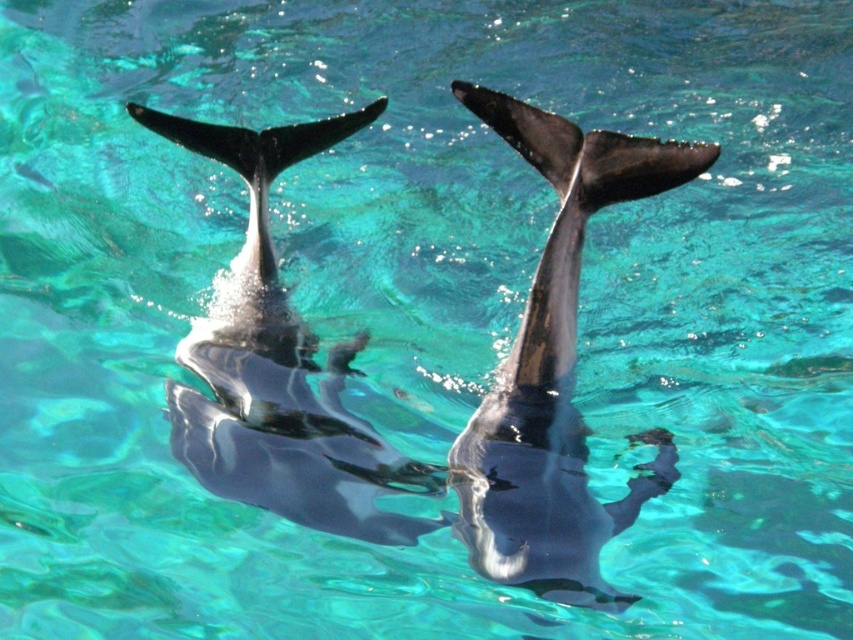
Who is shorter, glossy black dolphin at center or shiny black dolphin at center?

With less height is shiny black dolphin at center.

Does glossy black dolphin at center have a lesser height compared to shiny black dolphin at center?

Incorrect, glossy black dolphin at center's height does not fall short of shiny black dolphin at center's.

Locate an element on the screen. This screenshot has height=640, width=853. glossy black dolphin at center is located at coordinates (555, 371).